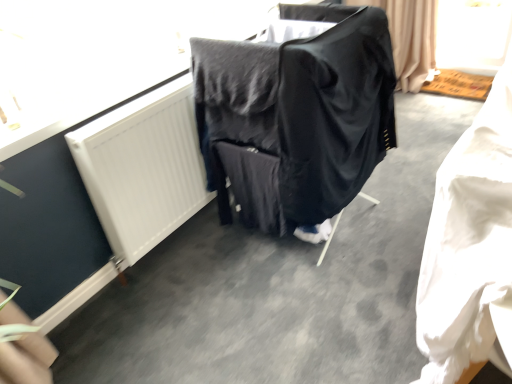
The width and height of the screenshot is (512, 384). I want to click on black fabric-covered chair at center, so click(296, 118).

Find the location of `clothing in front of the white matte radiator at upper left`. clothing in front of the white matte radiator at upper left is located at coordinates (470, 245).

Which object is positioned more to the left, white fabric at lower right or white matte radiator at upper left?

white matte radiator at upper left.

Measure the distance from white fabric at lower right to white matte radiator at upper left.

A distance of 1.17 meters exists between white fabric at lower right and white matte radiator at upper left.

Between white fabric at lower right and white matte radiator at upper left, which one has larger width?

Wider between the two is white fabric at lower right.

Considering the relative sizes of black fabric-covered chair at center and white matte radiator at upper left in the image provided, is black fabric-covered chair at center taller than white matte radiator at upper left?

Yes, black fabric-covered chair at center is taller than white matte radiator at upper left.

Is white matte radiator at upper left at the back of black fabric-covered chair at center?

Yes, black fabric-covered chair at center's orientation is away from white matte radiator at upper left.

Is black fabric-covered chair at center surrounding white matte radiator at upper left?

No, white matte radiator at upper left is not surrounded by black fabric-covered chair at center.

In terms of size, does black fabric-covered chair at center appear bigger or smaller than white matte radiator at upper left?

Clearly, black fabric-covered chair at center is larger in size than white matte radiator at upper left.

Can you tell me how much white matte radiator at upper left and white fabric at lower right differ in facing direction?

The angle between the facing direction of white matte radiator at upper left and the facing direction of white fabric at lower right is 1.03 degrees.

Locate an element on the screen. This screenshot has height=384, width=512. radiator lying above the white fabric at lower right (from the image's perspective) is located at coordinates (143, 168).

Is the surface of white matte radiator at upper left in direct contact with white fabric at lower right?

No, white matte radiator at upper left is not touching white fabric at lower right.

In the scene shown: Is white matte radiator at upper left oriented away from white fabric at lower right?

That's not correct — white matte radiator at upper left is not looking away from white fabric at lower right.

Is white fabric at lower right positioned beyond the bounds of black fabric-covered chair at center?

Absolutely, white fabric at lower right is external to black fabric-covered chair at center.

From the image's perspective, which one is positioned higher, white fabric at lower right or black fabric-covered chair at center?

black fabric-covered chair at center, from the image's perspective.

Which is behind, white fabric at lower right or black fabric-covered chair at center?

black fabric-covered chair at center is further away from the camera.

Is white matte radiator at upper left not close to black fabric-covered chair at center?

That's not correct — white matte radiator at upper left is a little close to black fabric-covered chair at center.

Would you say white matte radiator at upper left is to the left or to the right of black fabric-covered chair at center in the picture?

Based on their positions, white matte radiator at upper left is located to the left of black fabric-covered chair at center.

Which point is more distant from viewer, [141,180] or [300,71]?

Positioned behind is point [141,180].

Considering the relative sizes of black fabric-covered chair at center and white fabric at lower right in the image provided, is black fabric-covered chair at center taller than white fabric at lower right?

Indeed, black fabric-covered chair at center has a greater height compared to white fabric at lower right.

Can we say black fabric-covered chair at center lies outside white fabric at lower right?

black fabric-covered chair at center lies outside white fabric at lower right's area.

How different are the orientations of black fabric-covered chair at center and white fabric at lower right in degrees?

1.25 degrees.

Where is `radiator directly beneath the white fabric at lower right (from a real-world perspective)`? The image size is (512, 384). radiator directly beneath the white fabric at lower right (from a real-world perspective) is located at coordinates (143, 168).

You are a GUI agent. You are given a task and a screenshot of the screen. Output one action in this format:
    pyautogui.click(x=<x>, y=<y>)
    Task: Click on the radiator on the left of black fabric-covered chair at center
    This screenshot has height=384, width=512.
    Given the screenshot: What is the action you would take?
    pyautogui.click(x=143, y=168)

When comparing their distances from white fabric at lower right, does black fabric-covered chair at center or white matte radiator at upper left seem closer?

black fabric-covered chair at center is positioned closer to the anchor white fabric at lower right.

From the image, which object appears to be nearer to white matte radiator at upper left, white fabric at lower right or black fabric-covered chair at center?

black fabric-covered chair at center lies closer to white matte radiator at upper left than the other object.

Considering their positions, is white fabric at lower right positioned further to black fabric-covered chair at center than white matte radiator at upper left?

white fabric at lower right is positioned further to the anchor black fabric-covered chair at center.

Which object lies further to the anchor point white matte radiator at upper left, black fabric-covered chair at center or white fabric at lower right?

Among the two, white fabric at lower right is located further to white matte radiator at upper left.

Estimate the real-world distances between objects in this image. Which object is closer to black fabric-covered chair at center, white matte radiator at upper left or white fabric at lower right?

The object closer to black fabric-covered chair at center is white matte radiator at upper left.

From the picture: Based on their spatial positions, is white matte radiator at upper left or black fabric-covered chair at center further from white fabric at lower right?

white matte radiator at upper left is further to white fabric at lower right.

Find the location of a particular element. Image resolution: width=512 pixels, height=384 pixels. furniture between white matte radiator at upper left and white fabric at lower right is located at coordinates (296, 118).